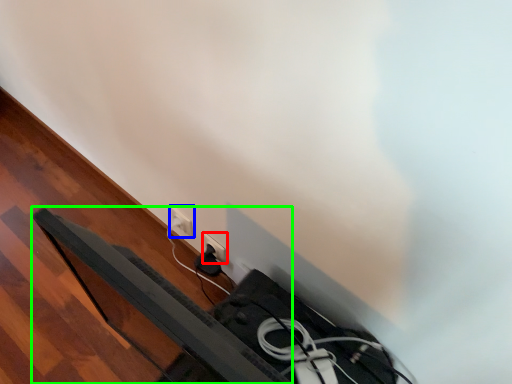
Question: Based on their relative distances, which object is farther from power plugs and sockets (highlighted by a red box)? Choose from power plugs and sockets (highlighted by a blue box) and bed frame (highlighted by a green box).

Choices:
 (A) power plugs and sockets
 (B) bed frame

Answer: (B)